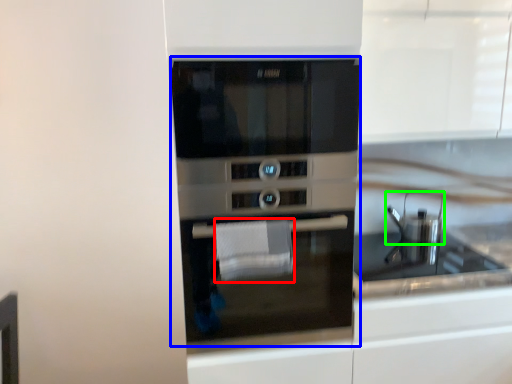
Question: Which is farther away from hand towel (highlighted by a red box)? oven (highlighted by a blue box) or appliance (highlighted by a green box)?

Choices:
 (A) oven
 (B) appliance

Answer: (B)